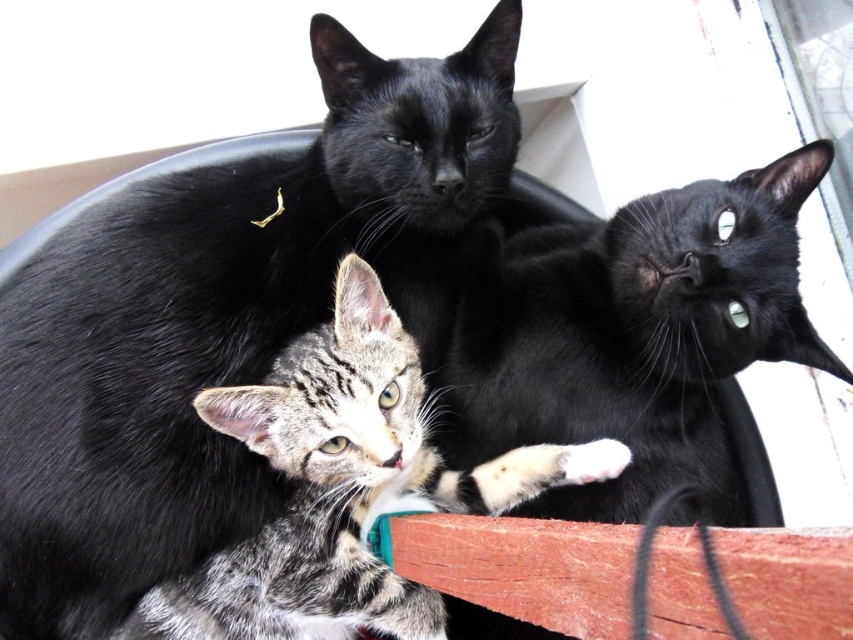
Question: Which of the following is the farthest from the observer?

Choices:
 (A) black glossy cat at upper right
 (B) shiny black cat at upper center

Answer: (A)

Question: Does shiny black cat at upper center lie in front of black glossy cat at upper right?

Choices:
 (A) yes
 (B) no

Answer: (A)

Question: Can you confirm if shiny black cat at upper center is thinner than black glossy cat at upper right?

Choices:
 (A) no
 (B) yes

Answer: (A)

Question: Among these objects, which one is farthest from the camera?

Choices:
 (A) black glossy cat at upper right
 (B) shiny black cat at upper center

Answer: (A)

Question: Is shiny black cat at upper center thinner than black glossy cat at upper right?

Choices:
 (A) no
 (B) yes

Answer: (A)

Question: Which point is farther to the camera?

Choices:
 (A) shiny black cat at upper center
 (B) black glossy cat at upper right

Answer: (B)